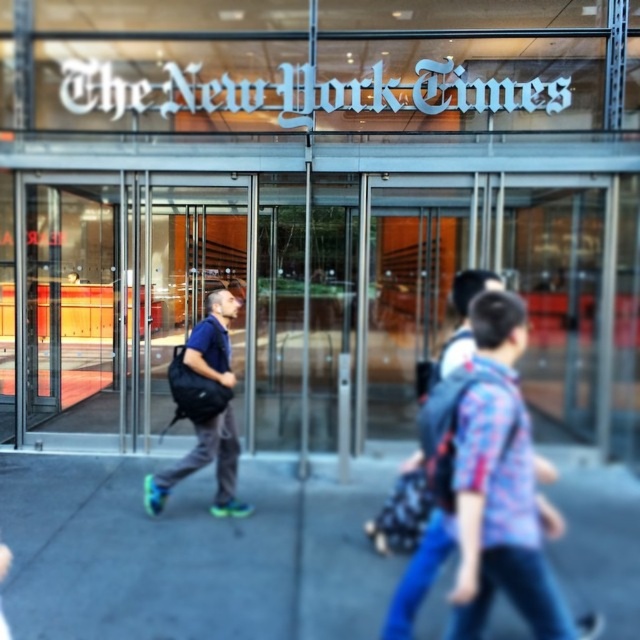
You are standing at the entrance of The New York Times building and want to take a photo of the flannel shirt at center without including the gray concrete sidewalk at center in the frame. Is this possible based on their positions?

The flannel shirt at center is behind the gray concrete sidewalk at center, so it would not be visible in a photo that excludes the sidewalk.

You are standing at the entrance of The New York Times building and see two points marked on the ground. One is at point (20, 586) and the other at point (522, 410). If you want to walk towards the point that is further away from you, which point should you choose?

Point (20, 586) is behind point (522, 410), so if you want to walk towards the point that is further away from you, you should choose point (20, 586).